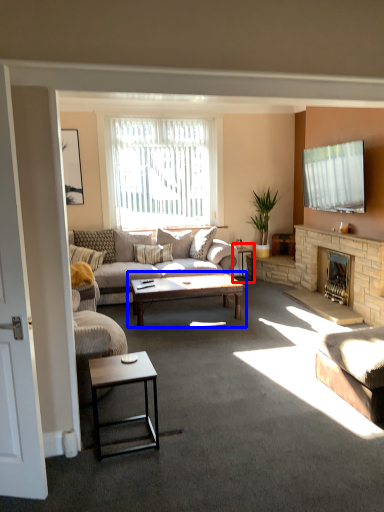
Question: Which of the following is the closest to the observer, side table (highlighted by a red box) or coffee table (highlighted by a blue box)?

Choices:
 (A) side table
 (B) coffee table

Answer: (B)